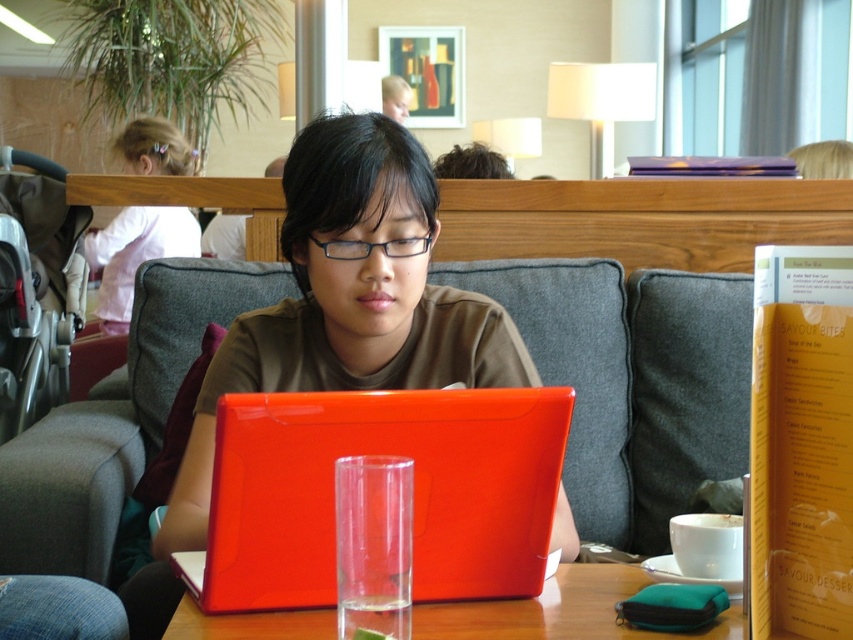
You are a customer in the cafe and want to place your phone on the table. The table has a glossy plastic laptop at center and other items. Where should you place your phone so it doesn not slide off? The coordinates of the laptop are given as point (413, 490). Please provide coordinates in the format of x,y between 0 and 1.

The point (413, 490) is on the glossy plastic laptop at center. To avoid sliding, place the phone away from the laptop, perhaps near the edge of the table but not over the laptop. Since the laptop is at center, placing the phone towards the upper right or left edges might be safer. However, exact coordinates aren t provided, so general advice is best.

You are a delivery person standing at the entrance of the cafe. You need to place a package on the table where the person is working on the glossy plastic laptop at center. The package is 12 inches wide. Can you safely place it on the table without disturbing the laptop?

The glossy plastic laptop at center is 33.15 inches away from the viewer. Since the package is 12 inches wide, it can be placed on the table without disturbing the laptop as long as there is enough space around the laptop.

Based on the photo, you are a barista who needs to deliver a drink to the customer at the table with the matte plastic laptop at center and transparent glass at center. The drink should be placed on the table without obstructing the laptop. Where should you place the drink?

The drink should be placed on the table below the matte plastic laptop at center since it is above the transparent glass at center, ensuring the laptop remains unobstructed.